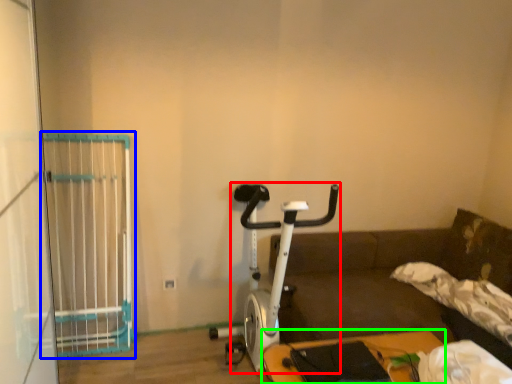
Question: Estimate the real-world distances between objects in this image. Which object is farther from stationary bicycle (highlighted by a red box), cage (highlighted by a blue box) or furniture (highlighted by a green box)?

Choices:
 (A) cage
 (B) furniture

Answer: (A)